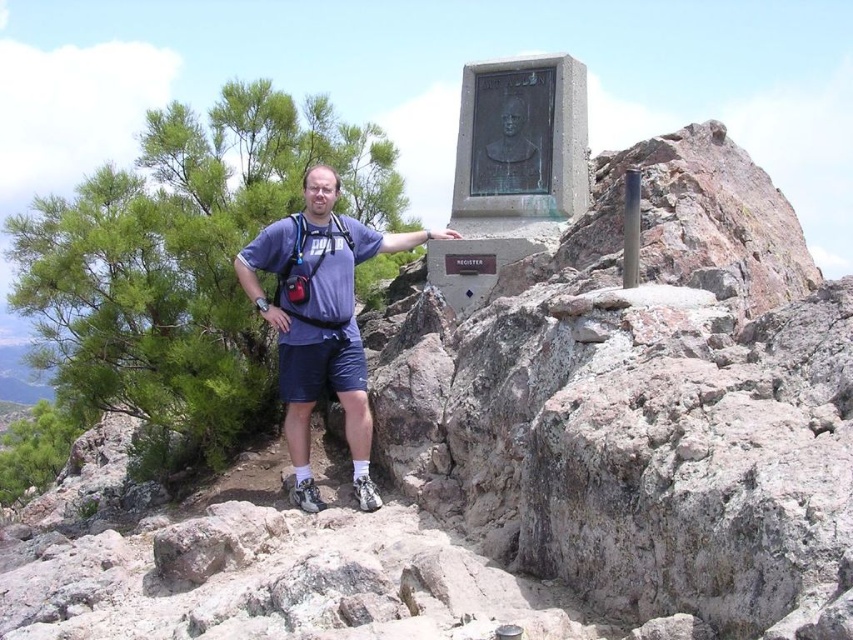
Describe the element at coordinates (320, 321) in the screenshot. This screenshot has width=853, height=640. I see `matte blue shirt at center` at that location.

Is matte blue shirt at center closer to camera compared to bronze bust at upper center?

Yes.

The width and height of the screenshot is (853, 640). I want to click on matte blue shirt at center, so point(320,321).

Where is `matte blue shirt at center`? matte blue shirt at center is located at coordinates (320, 321).

Locate an element on the screen. The width and height of the screenshot is (853, 640). green leafy pine at left is located at coordinates (183, 259).

Consider the image. Does green leafy pine at left have a larger size compared to bronze bust at upper center?

Yes, green leafy pine at left is bigger than bronze bust at upper center.

What do you see at coordinates (183, 259) in the screenshot? I see `green leafy pine at left` at bounding box center [183, 259].

At what (x,y) coordinates should I click in order to perform the action: click on green leafy pine at left. Please return your answer as a coordinate pair (x, y). Looking at the image, I should click on (183, 259).

Between green leafy pine at left and matte blue shirt at center, which one has less height?

With less height is matte blue shirt at center.

The height and width of the screenshot is (640, 853). Describe the element at coordinates (183, 259) in the screenshot. I see `green leafy pine at left` at that location.

Image resolution: width=853 pixels, height=640 pixels. What do you see at coordinates (183, 259) in the screenshot? I see `green leafy pine at left` at bounding box center [183, 259].

Find the location of a particular element. The height and width of the screenshot is (640, 853). green leafy pine at left is located at coordinates (183, 259).